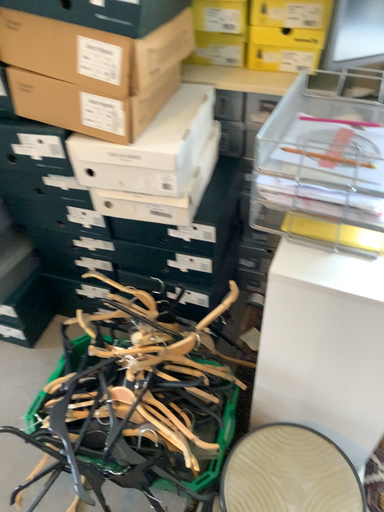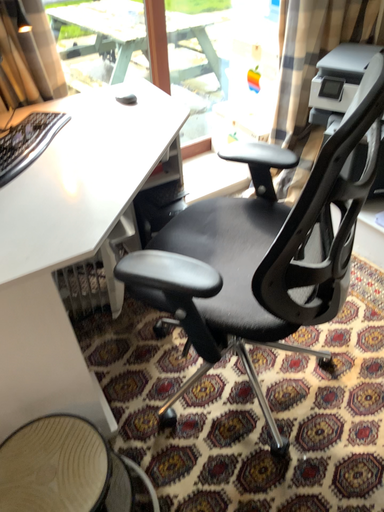
Question: Which way did the camera rotate in the video?

Choices:
 (A) rotated downward
 (B) rotated upward

Answer: (B)